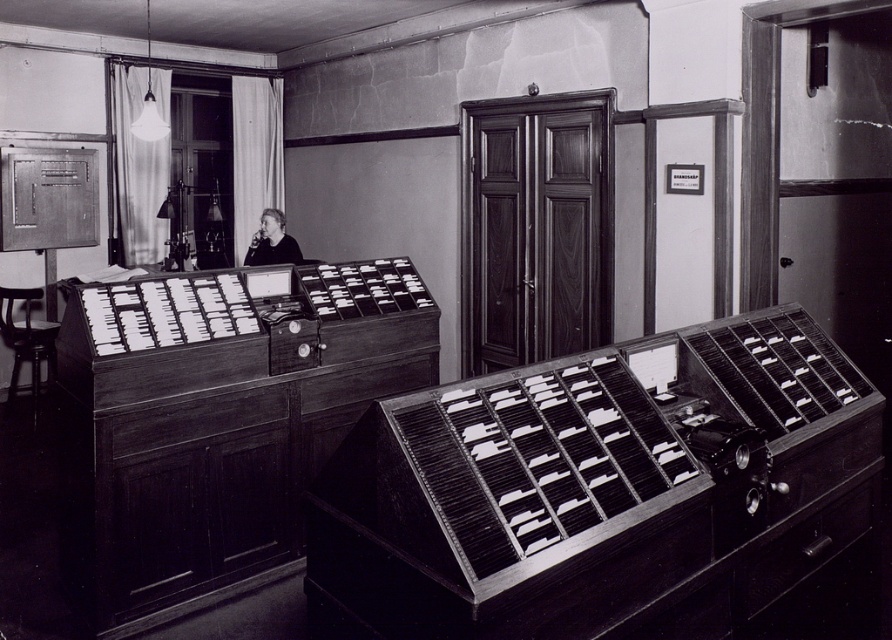
Question: Does dark wood stool at left appear over dark gray fabric jacket at center?

Choices:
 (A) yes
 (B) no

Answer: (B)

Question: Among these points, which one is farthest from the camera?

Choices:
 (A) tap(50, 356)
 (B) tap(785, 556)
 (C) tap(273, 212)

Answer: (A)

Question: Can you confirm if metallic drawer at lower right is thinner than dark wood stool at left?

Choices:
 (A) no
 (B) yes

Answer: (A)

Question: Can you confirm if metallic drawer at lower right is bigger than dark wood stool at left?

Choices:
 (A) yes
 (B) no

Answer: (B)

Question: Which point appears farthest from the camera in this image?

Choices:
 (A) (872, 497)
 (B) (23, 307)

Answer: (B)

Question: Which is farther from the metallic drawer at lower right?

Choices:
 (A) dark gray fabric jacket at center
 (B) dark wood stool at left

Answer: (B)